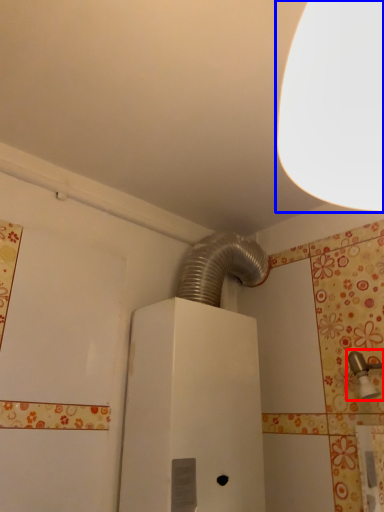
Question: Which object is closer to the camera taking this photo, plumbing fixture (highlighted by a red box) or lamp (highlighted by a blue box)?

Choices:
 (A) plumbing fixture
 (B) lamp

Answer: (B)